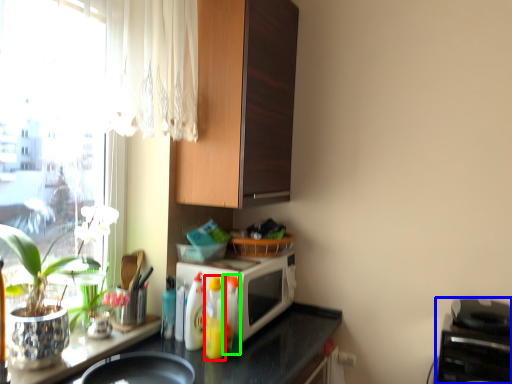
Question: Which object is the closest to the bottle (highlighted by a red box)? Choose among these: appliance (highlighted by a blue box) or bottle (highlighted by a green box).

Choices:
 (A) appliance
 (B) bottle

Answer: (B)